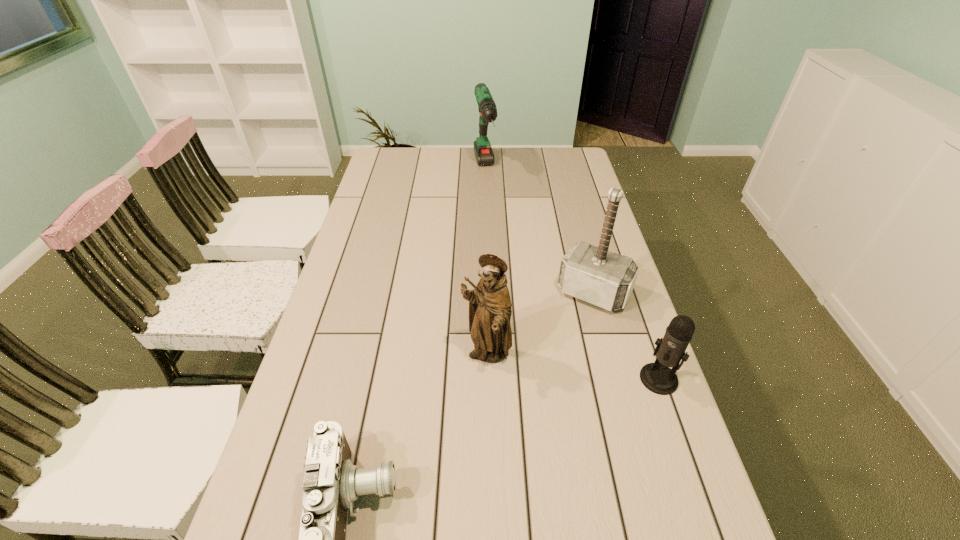
This screenshot has width=960, height=540. Identify the location of vacant space on the desktop that is between the camera and the microphone and is positioned for striking with the head of the fourth nearest object. (503, 444).

This screenshot has width=960, height=540. What are the coordinates of `free space on the desktop that is between the shortest object and the microphone and is positioned on the handle side of the farthest object` in the screenshot? It's located at (556, 422).

Find the location of a particular element. The height and width of the screenshot is (540, 960). vacant spot on the desktop that is between the shortest object and the microphone and is positioned on the front-facing side of the figurine is located at coordinates (480, 455).